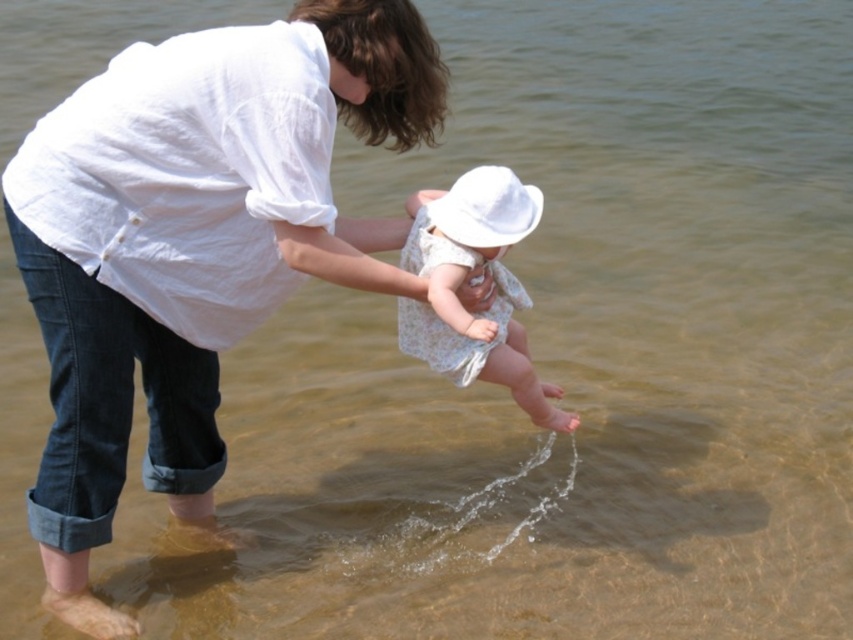
Who is positioned more to the left, white lace dress at center or white matte hat at center?

white matte hat at center

Can you confirm if white lace dress at center is taller than white matte hat at center?

Indeed, white lace dress at center has a greater height compared to white matte hat at center.

Locate an element on the screen. Image resolution: width=853 pixels, height=640 pixels. white lace dress at center is located at coordinates (462, 276).